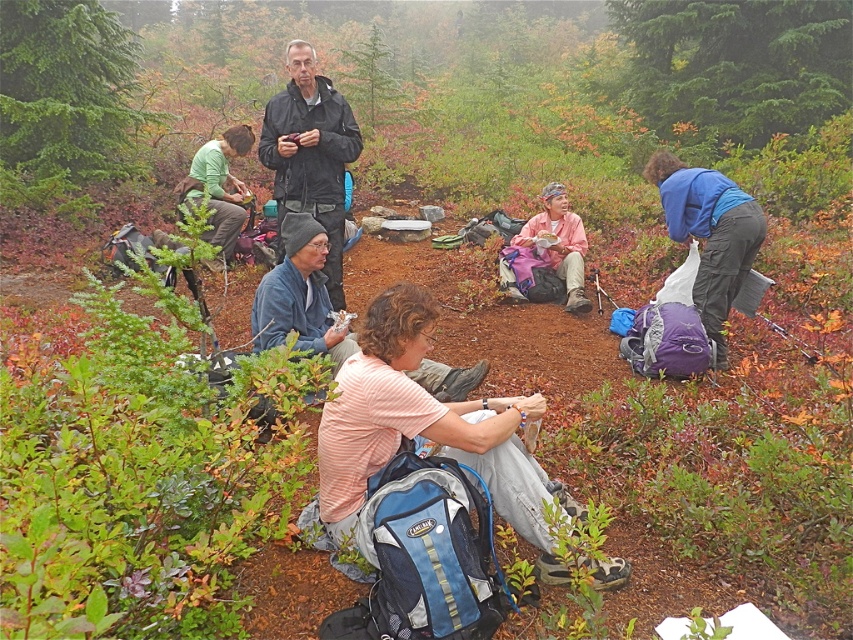
Who is shorter, striped cotton shirt at center or pink fabric at center?

With less height is striped cotton shirt at center.

You are a GUI agent. You are given a task and a screenshot of the screen. Output one action in this format:
    pyautogui.click(x=<x>, y=<y>)
    Task: Click on the striped cotton shirt at center
    The image size is (853, 640).
    Given the screenshot: What is the action you would take?
    pyautogui.click(x=426, y=428)

This screenshot has height=640, width=853. In order to click on striped cotton shirt at center in this screenshot , I will do `click(426, 428)`.

Does black matte jacket at center have a greater width compared to pink fabric at center?

No.

Identify the location of black matte jacket at center. The width and height of the screenshot is (853, 640). (310, 154).

Is point (437, 436) behind point (329, 177)?

No, (437, 436) is in front of (329, 177).

Does point (346, 426) lie in front of point (283, 115)?

Yes, it is in front of point (283, 115).

At what (x,y) coordinates should I click in order to perform the action: click on striped cotton shirt at center. Please return your answer as a coordinate pair (x, y). The width and height of the screenshot is (853, 640). Looking at the image, I should click on (426, 428).